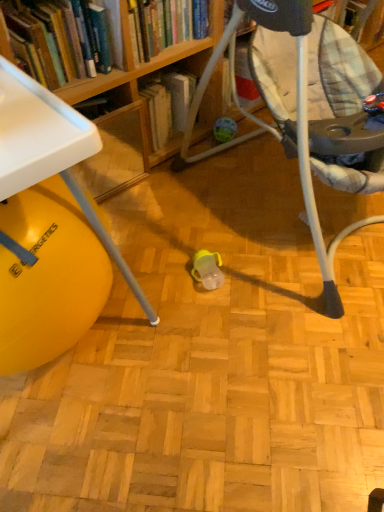
Question: Considering the relative positions of hardcover book at upper left, which is counted as the 2th book, starting from the left, and hardcover book at upper left, which is counted as the 2th book, starting from the right, in the image provided, is hardcover book at upper left, which is counted as the 2th book, starting from the left, behind hardcover book at upper left, which is counted as the 2th book, starting from the right,?

Choices:
 (A) no
 (B) yes

Answer: (B)

Question: Is hardcover book at upper left, the first book from the right, aimed at hardcover book at upper left, the first book when ordered from left to right?

Choices:
 (A) yes
 (B) no

Answer: (B)

Question: From a real-world perspective, is hardcover book at upper left, which is counted as the 2th book, starting from the left, physically above hardcover book at upper left, which is counted as the 2th book, starting from the right?

Choices:
 (A) no
 (B) yes

Answer: (A)

Question: Does hardcover book at upper left, which is counted as the 2th book, starting from the left, have a greater width compared to hardcover book at upper left, which is counted as the 2th book, starting from the right?

Choices:
 (A) yes
 (B) no

Answer: (A)

Question: Is hardcover book at upper left, the first book from the right, bigger than hardcover book at upper left, the first book when ordered from left to right?

Choices:
 (A) no
 (B) yes

Answer: (A)

Question: Is hardcover book at upper left, which is counted as the 2th book, starting from the right, to the left or to the right of matte plastic baby swing at center in the image?

Choices:
 (A) right
 (B) left

Answer: (B)

Question: Considering the positions of hardcover book at upper left, the first book when ordered from left to right, and matte plastic baby swing at center in the image, is hardcover book at upper left, the first book when ordered from left to right, taller or shorter than matte plastic baby swing at center?

Choices:
 (A) tall
 (B) short

Answer: (B)

Question: From a real-world perspective, relative to matte plastic baby swing at center, is hardcover book at upper left, the first book when ordered from left to right, vertically above or below?

Choices:
 (A) above
 (B) below

Answer: (A)

Question: In terms of width, does hardcover book at upper left, which is counted as the 2th book, starting from the right, look wider or thinner when compared to matte plastic baby swing at center?

Choices:
 (A) wide
 (B) thin

Answer: (B)

Question: Is hardcover book at upper left, which is counted as the 2th book, starting from the left, to the left or to the right of hardcover book at upper left, the first book when ordered from left to right, in the image?

Choices:
 (A) right
 (B) left

Answer: (A)

Question: Does point (160, 19) appear closer or farther from the camera than point (84, 59)?

Choices:
 (A) closer
 (B) farther

Answer: (B)

Question: In terms of width, does hardcover book at upper left, which is counted as the 2th book, starting from the left, look wider or thinner when compared to hardcover book at upper left, the first book when ordered from left to right?

Choices:
 (A) wide
 (B) thin

Answer: (A)

Question: From their relative heights in the image, would you say hardcover book at upper left, the first book from the right, is taller or shorter than hardcover book at upper left, which is counted as the 2th book, starting from the right?

Choices:
 (A) short
 (B) tall

Answer: (A)

Question: Is point (283, 56) closer or farther from the camera than point (155, 10)?

Choices:
 (A) closer
 (B) farther

Answer: (A)

Question: In terms of height, does matte plastic baby swing at center look taller or shorter compared to hardcover book at upper left, the first book from the right?

Choices:
 (A) tall
 (B) short

Answer: (A)